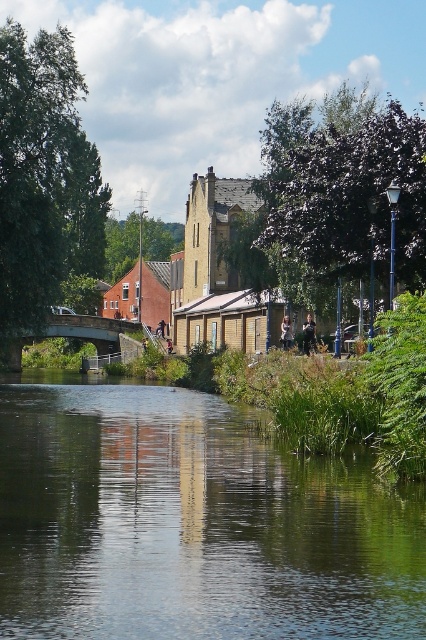
Is green reflective water at center to the left of dark brown leather jacket at center from the viewer's perspective?

Yes, green reflective water at center is to the left of dark brown leather jacket at center.

Who is lower down, green reflective water at center or dark brown leather jacket at center?

green reflective water at center

Between point (97, 445) and point (314, 337), which one is positioned in front?

Positioned in front is point (97, 445).

Where is `green reflective water at center`? The width and height of the screenshot is (426, 640). green reflective water at center is located at coordinates pyautogui.click(x=192, y=524).

In the scene shown: How much distance is there between dark brown leather jacket at center and light brown leather jacket at center?

dark brown leather jacket at center and light brown leather jacket at center are 2.79 meters apart from each other.

I want to click on dark brown leather jacket at center, so click(x=308, y=336).

Does green reflective water at center have a larger size compared to light brown leather jacket at center?

Correct, green reflective water at center is larger in size than light brown leather jacket at center.

Measure the distance between green reflective water at center and camera.

green reflective water at center is 11.06 meters away from camera.

Between point (65, 456) and point (284, 332), which one is positioned in front?

Point (65, 456) is in front.

In order to click on green reflective water at center in this screenshot , I will do `click(192, 524)`.